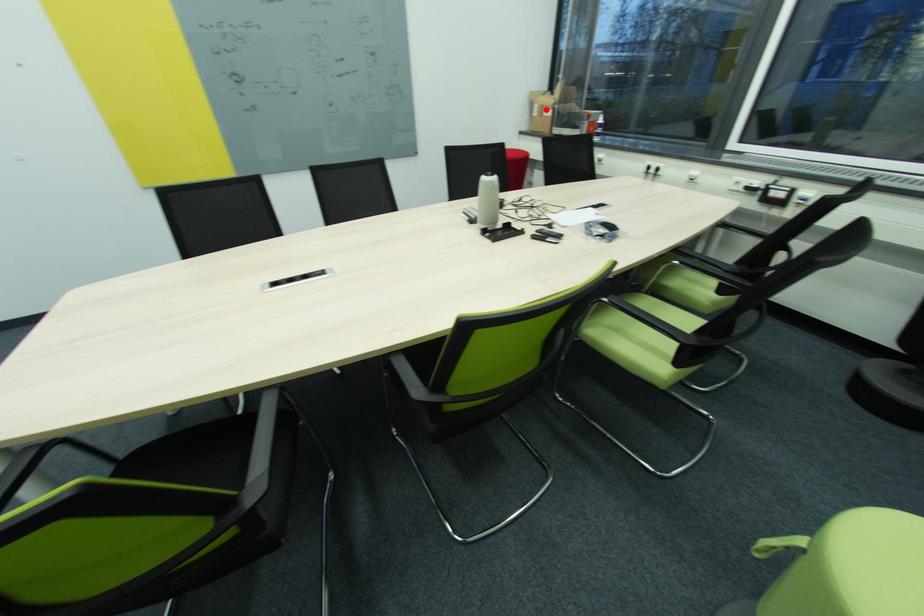
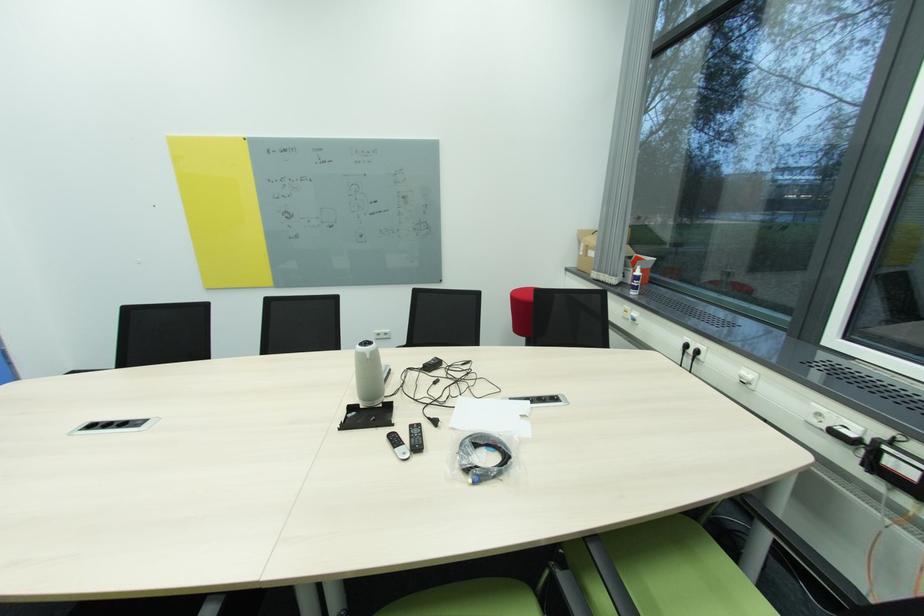
Question: I am providing you with two images of the same scene from different viewpoints. A red point is marked on the first image. Is the red point's position out of view in image 2?

Choices:
 (A) Yes
 (B) No

Answer: (B)